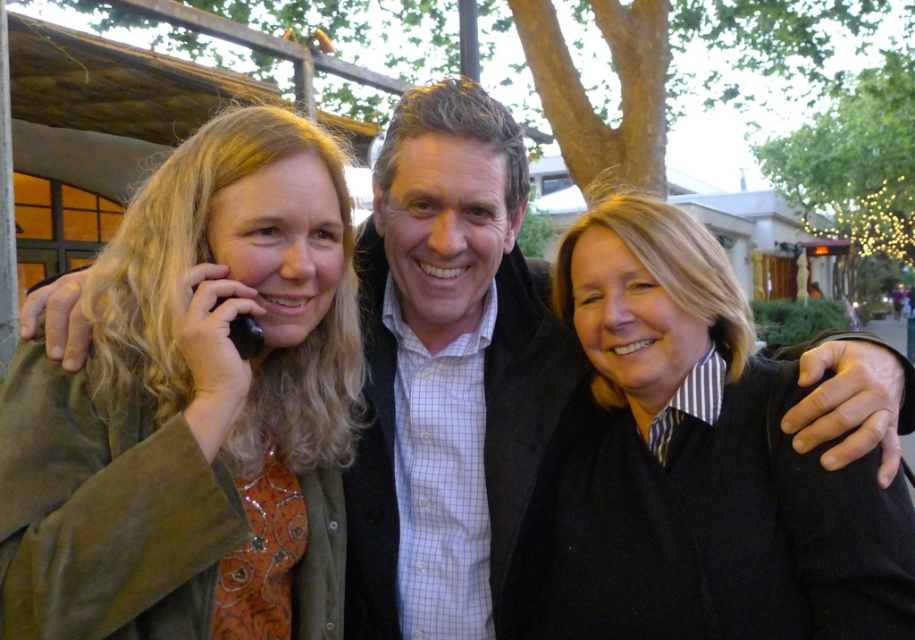
Does matte green jacket at left appear over black wool sweater at center?

Indeed, matte green jacket at left is positioned over black wool sweater at center.

Locate an element on the screen. The height and width of the screenshot is (640, 915). matte green jacket at left is located at coordinates (195, 408).

At what (x,y) coordinates should I click in order to perform the action: click on matte green jacket at left. Please return your answer as a coordinate pair (x, y). This screenshot has height=640, width=915. Looking at the image, I should click on (195, 408).

Can you confirm if black wool sweater at center is wider than white checkered shirt at center?

Yes.

Where is `black wool sweater at center`? The image size is (915, 640). black wool sweater at center is located at coordinates (696, 464).

Describe the element at coordinates (696, 464) in the screenshot. This screenshot has height=640, width=915. I see `black wool sweater at center` at that location.

The height and width of the screenshot is (640, 915). In order to click on black wool sweater at center in this screenshot , I will do `click(696, 464)`.

Which of these two, matte green jacket at left or white checkered shirt at center, stands shorter?

matte green jacket at left

Who is higher up, matte green jacket at left or white checkered shirt at center?

Positioned higher is white checkered shirt at center.

This screenshot has height=640, width=915. Describe the element at coordinates (195, 408) in the screenshot. I see `matte green jacket at left` at that location.

Locate an element on the screen. This screenshot has height=640, width=915. matte green jacket at left is located at coordinates (195, 408).